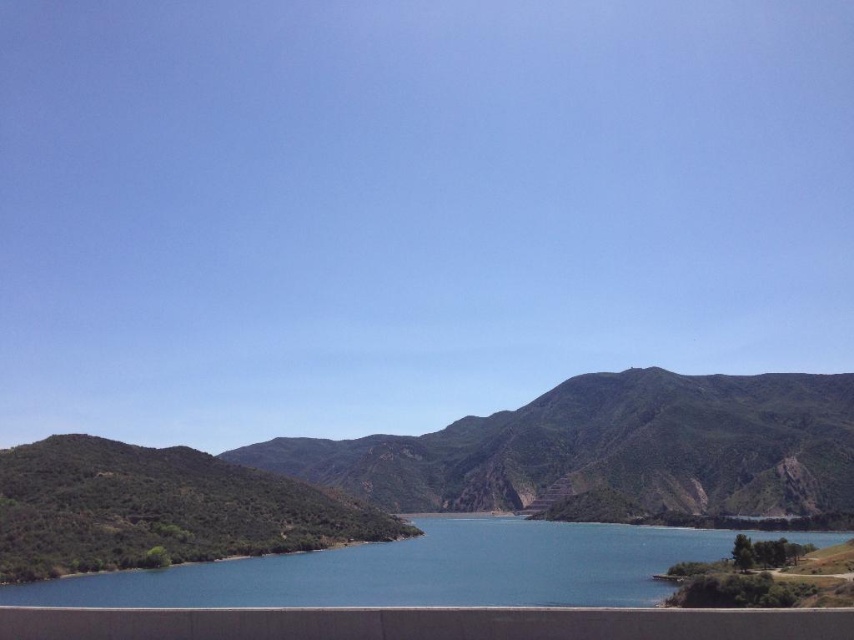
Question: Which object is closer to the camera taking this photo?

Choices:
 (A) green textured hillside at center
 (B) blue water at center

Answer: (B)

Question: Does green textured hillside at center have a lesser width compared to blue water at center?

Choices:
 (A) yes
 (B) no

Answer: (B)

Question: Is green textured hillside at center to the left of blue water at center from the viewer's perspective?

Choices:
 (A) yes
 (B) no

Answer: (A)

Question: Does green textured hillside at center appear on the left side of blue water at center?

Choices:
 (A) no
 (B) yes

Answer: (B)